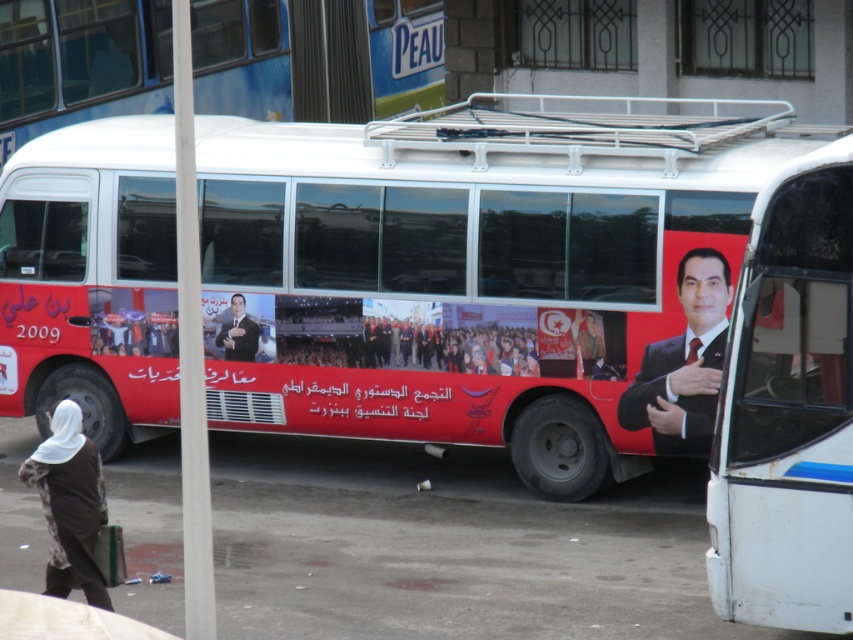
Question: Can you confirm if white matte bus at right is smaller than brown fabric hijab at lower left?

Choices:
 (A) yes
 (B) no

Answer: (B)

Question: Which object is closer to the camera taking this photo?

Choices:
 (A) smooth black suit at center
 (B) red matte bus at center
 (C) brown fabric hijab at lower left

Answer: (C)

Question: Is red matte bus at center wider than smooth suit at right?

Choices:
 (A) no
 (B) yes

Answer: (B)

Question: Among these points, which one is nearest to the camera?

Choices:
 (A) (343, 284)
 (B) (708, 298)
 (C) (245, 333)

Answer: (B)

Question: Observing the image, what is the correct spatial positioning of red matte bus at center in reference to white matte bus at right?

Choices:
 (A) above
 (B) below

Answer: (A)

Question: Which object is positioned closest to the brown fabric hijab at lower left?

Choices:
 (A) smooth black suit at center
 (B) white matte bus at right
 (C) smooth suit at right
 (D) red matte bus at center

Answer: (B)